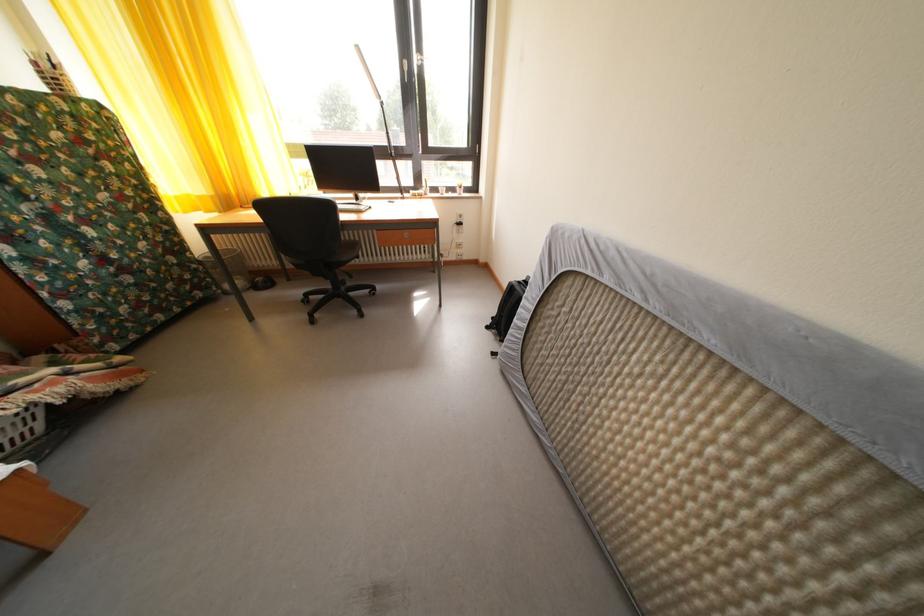
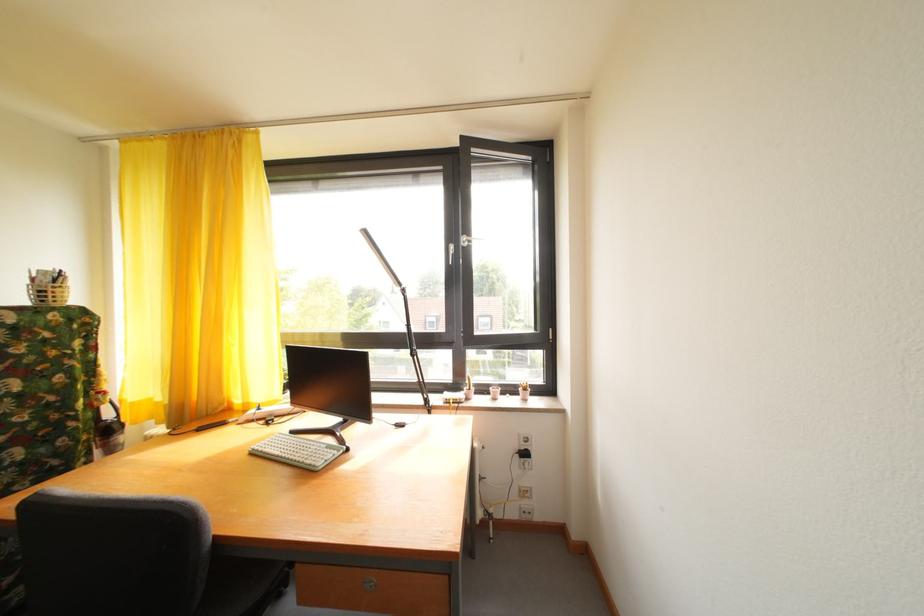
The point at (43,70) is marked in the first image. Where is the corresponding point in the second image?

(43, 286)